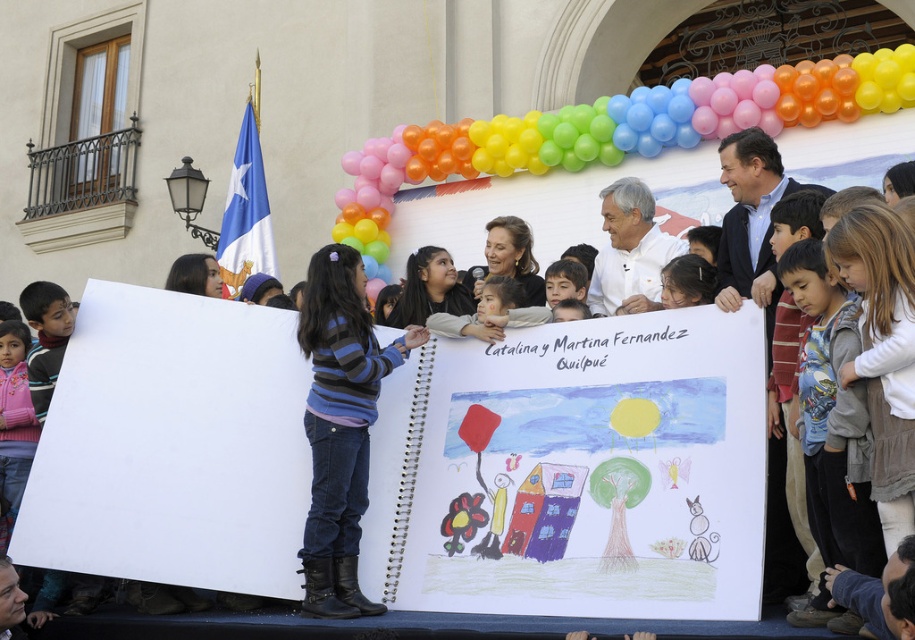
Question: Is white paper at center bigger than fluffy pink jacket at left?

Choices:
 (A) yes
 (B) no

Answer: (A)

Question: Which point is closer to the camera taking this photo?

Choices:
 (A) (434, 548)
 (B) (687, 196)

Answer: (A)

Question: Does white paper at center have a lesser width compared to gray sweater at lower right?

Choices:
 (A) yes
 (B) no

Answer: (B)

Question: Which object is farther from the camera taking this photo?

Choices:
 (A) white paper at center
 (B) fluffy pink jacket at left

Answer: (B)

Question: Observing the image, what is the correct spatial positioning of striped sweater at center in reference to gray sweater at lower right?

Choices:
 (A) left
 (B) right

Answer: (A)

Question: Which is farther from the fluffy pink jacket at left?

Choices:
 (A) white paper at center
 (B) gray sweater at lower right

Answer: (B)